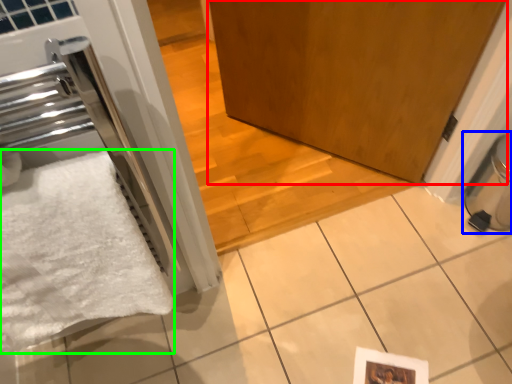
Question: Based on their relative distances, which object is nearer to door (highlighted by a red box)? Choose from water heater (highlighted by a blue box) and bath towel (highlighted by a green box).

Choices:
 (A) water heater
 (B) bath towel

Answer: (A)